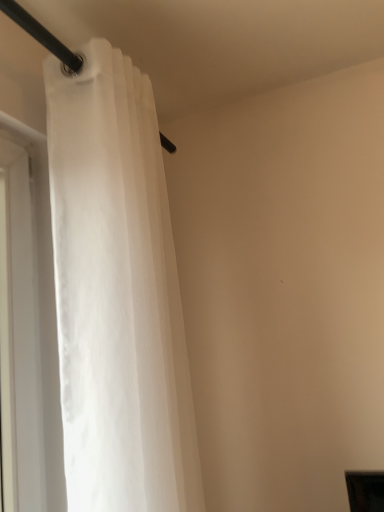
Describe the element at coordinates (117, 294) in the screenshot. I see `white sheer curtain at left` at that location.

What are the coordinates of `white sheer curtain at left` in the screenshot? It's located at (117, 294).

Locate an element on the screen. The height and width of the screenshot is (512, 384). white sheer curtain at left is located at coordinates (117, 294).